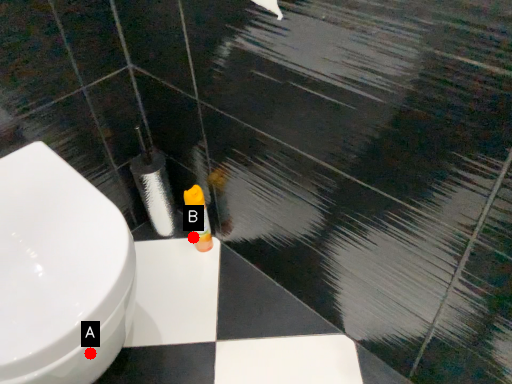
Question: Two points are circled on the image, labeled by A and B beside each circle. Which point is closer to the camera?

Choices:
 (A) A is closer
 (B) B is closer

Answer: (A)